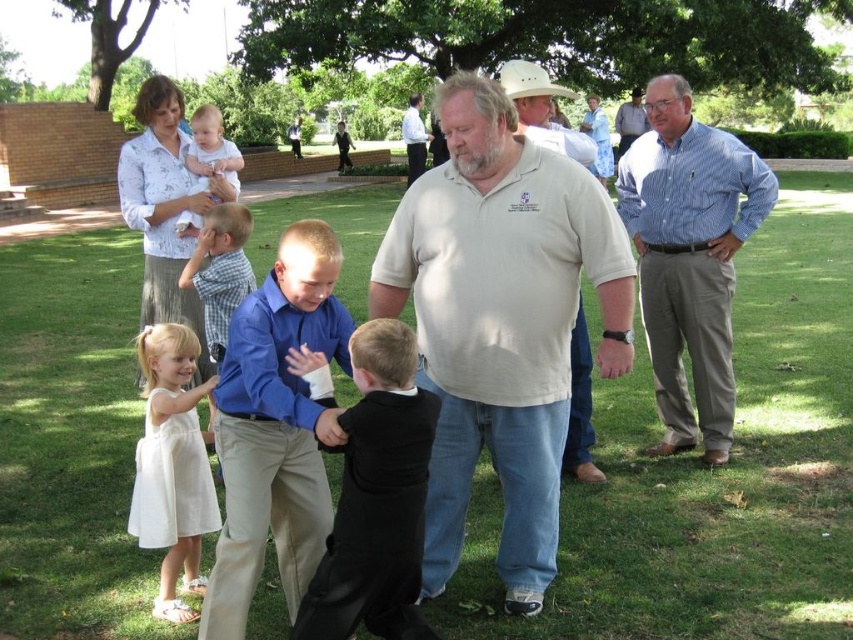
Question: Which point is closer to the camera taking this photo?

Choices:
 (A) (405, 634)
 (B) (425, 275)
 (C) (683, 289)

Answer: (A)

Question: Which point is farther from the camera taking this photo?

Choices:
 (A) (514, 445)
 (B) (473, 278)
 (C) (248, 212)

Answer: (C)

Question: Does matte white shirt at center have a lesser width compared to black satin suit at center?

Choices:
 (A) yes
 (B) no

Answer: (B)

Question: Is matte white shirt at center above light beige shirt at center?

Choices:
 (A) yes
 (B) no

Answer: (B)

Question: Which point is closer to the camera?

Choices:
 (A) light beige shirt at center
 (B) matte white shirt at center
 (C) blue cotton shirt at center
 (D) white cotton dress at lower left

Answer: (C)

Question: Can you confirm if white cotton shirt at center is thinner than light beige shirt at center?

Choices:
 (A) no
 (B) yes

Answer: (B)